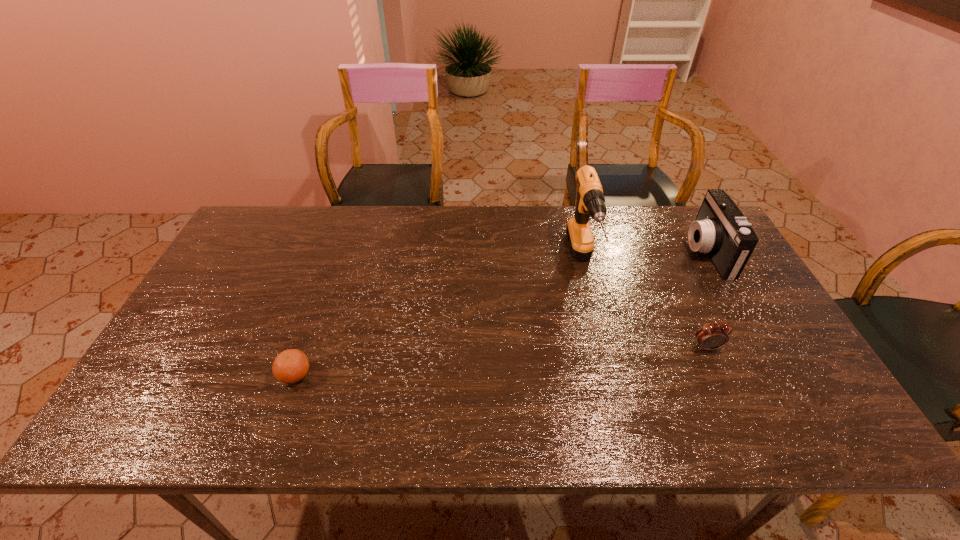
Identify the location of vacant area situated on the lens of the camcorder. (650, 252).

You are a GUI agent. You are given a task and a screenshot of the screen. Output one action in this format:
    pyautogui.click(x=<x>, y=<y>)
    Task: Click on the vacant point located 0.110m on the lens of the camcorder
    This screenshot has height=540, width=960.
    Given the screenshot: What is the action you would take?
    pyautogui.click(x=653, y=252)

You are a GUI agent. You are given a task and a screenshot of the screen. Output one action in this format:
    pyautogui.click(x=<x>, y=<y>)
    Task: Click on the vacant space located 0.210m on the face of the third object from left to right
    The height and width of the screenshot is (540, 960).
    Given the screenshot: What is the action you would take?
    pyautogui.click(x=745, y=431)

The width and height of the screenshot is (960, 540). I want to click on free spot located on the back of the shortest object, so click(x=314, y=320).

At what (x,y) coordinates should I click in order to perform the action: click on drill that is at the far edge. Please return your answer as a coordinate pair (x, y). The width and height of the screenshot is (960, 540). Looking at the image, I should click on (591, 202).

Where is `camcorder that is positioned at the far edge`? camcorder that is positioned at the far edge is located at coordinates (720, 229).

Locate an element on the screen. object that is at the right edge is located at coordinates (720, 229).

Locate an element on the screen. This screenshot has width=960, height=540. object located in the far right corner section of the desktop is located at coordinates (720, 229).

In the image, there is a desktop. At what (x,y) coordinates should I click in order to perform the action: click on vacant space at the far edge. Please return your answer as a coordinate pair (x, y). This screenshot has width=960, height=540. Looking at the image, I should click on (337, 205).

This screenshot has width=960, height=540. In the image, there is a desktop. Identify the location of free region at the near edge. (565, 421).